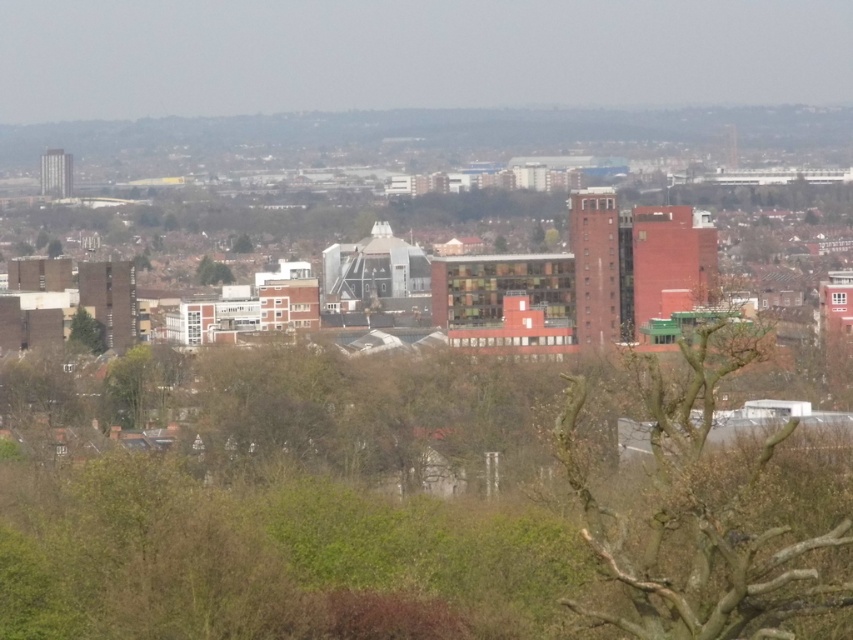
Question: Can you confirm if bare branches at center is positioned below green leafy tree at upper center?

Choices:
 (A) no
 (B) yes

Answer: (B)

Question: Which point is farther to the camera?

Choices:
 (A) green leafy tree at upper center
 (B) green leafy tree at lower left

Answer: (B)

Question: Considering the real-world distances, which object is closest to the bare branches at center?

Choices:
 (A) green leafy tree at lower left
 (B) green leafy tree at upper center

Answer: (B)

Question: Which of the following is the farthest from the observer?

Choices:
 (A) pyautogui.click(x=199, y=273)
 (B) pyautogui.click(x=773, y=582)
 (C) pyautogui.click(x=94, y=353)

Answer: (C)

Question: Is bare branches at center wider than green leafy tree at upper center?

Choices:
 (A) no
 (B) yes

Answer: (B)

Question: Is bare branches at center in front of green leafy tree at lower left?

Choices:
 (A) no
 (B) yes

Answer: (B)